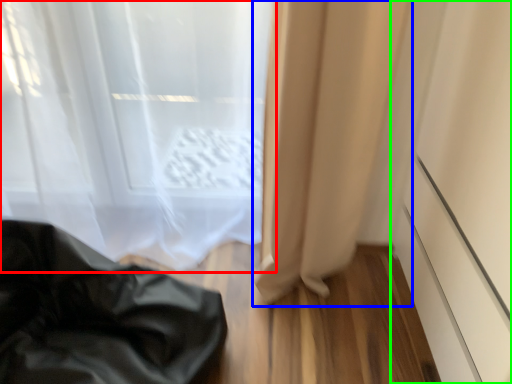
Question: Which is farther away from curtain (highlighted by a red box)? curtain (highlighted by a blue box) or screen door (highlighted by a green box)?

Choices:
 (A) curtain
 (B) screen door

Answer: (B)